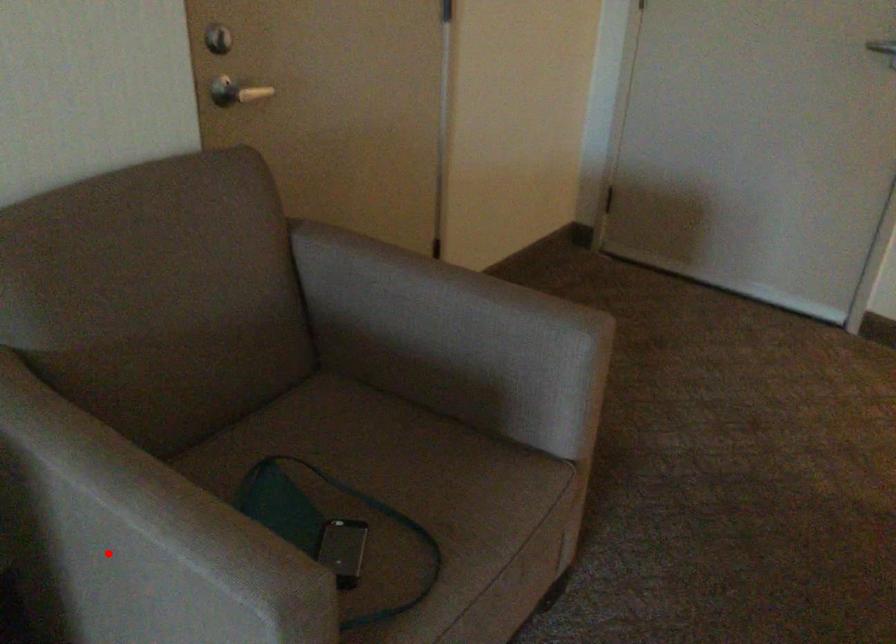
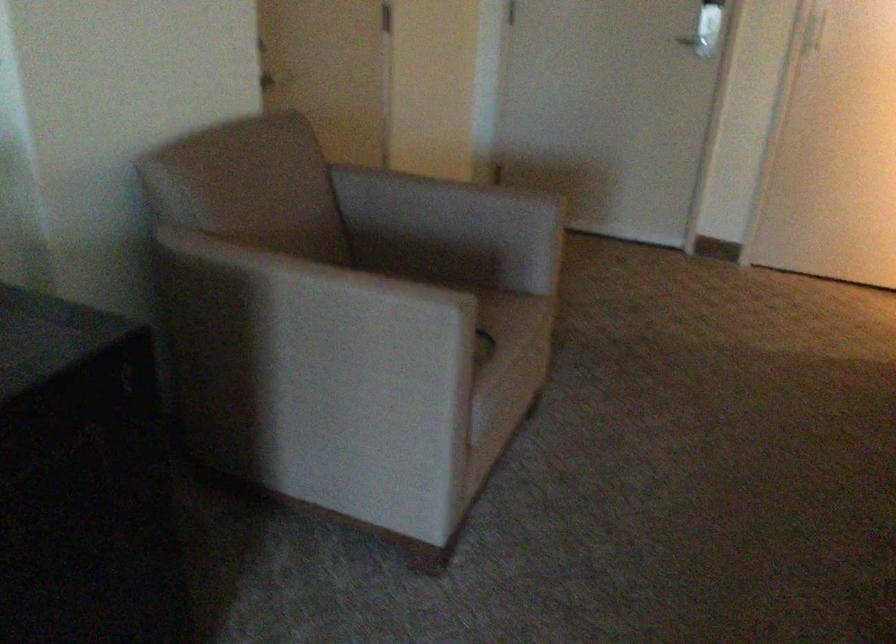
Question: I am providing you with two images of the same scene from different viewpoints. A red point is marked on the first image. Can you still see the location of the red point in image 2?

Choices:
 (A) Yes
 (B) No

Answer: (A)